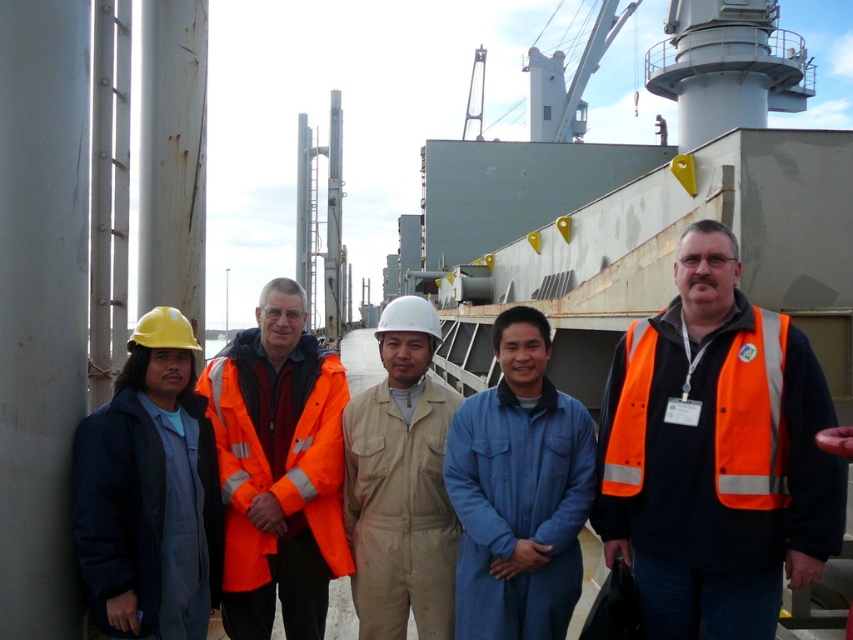
Question: Is blue cotton coverall at center thinner than orange reflective safety vest at right?

Choices:
 (A) no
 (B) yes

Answer: (B)

Question: Which object is closer to the camera taking this photo?

Choices:
 (A) blue cotton coverall at center
 (B) orange reflective vest at center

Answer: (B)

Question: Observing the image, what is the correct spatial positioning of orange reflective vest at center in reference to orange reflective safety vest at right?

Choices:
 (A) left
 (B) right

Answer: (B)

Question: Which of the following is the farthest from the observer?

Choices:
 (A) tan uniform at center
 (B) matte blue coveralls at left

Answer: (A)

Question: Which object is the farthest from the tan uniform at center?

Choices:
 (A) orange reflective jacket at center
 (B) orange reflective vest at center
 (C) matte blue coveralls at left
 (D) orange reflective safety vest at right

Answer: (B)

Question: Is orange reflective jacket at center behind blue cotton coverall at center?

Choices:
 (A) no
 (B) yes

Answer: (B)